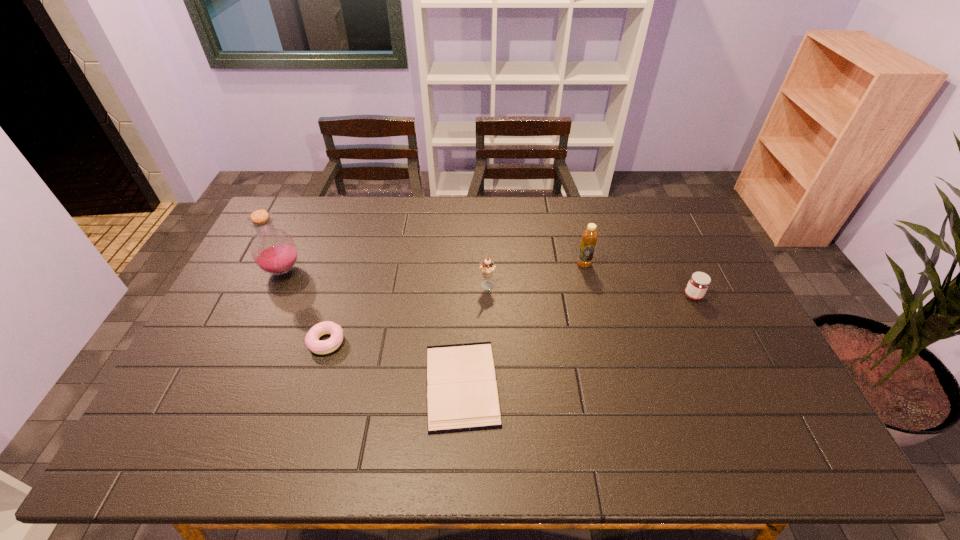
The width and height of the screenshot is (960, 540). In order to click on vacant area that lies between the shortest object and the fourth shortest object in this screenshot , I will do `click(474, 336)`.

This screenshot has width=960, height=540. In order to click on free space between the shortest object and the tallest object in this screenshot , I will do `click(372, 328)`.

Locate an element on the screen. The image size is (960, 540). free space between the icecream and the shorter bottle is located at coordinates (536, 275).

At what (x,y) coordinates should I click in order to perform the action: click on the closest object relative to the left bottle. Please return your answer as a coordinate pair (x, y). Looking at the image, I should click on (312, 341).

The image size is (960, 540). I want to click on object that stands as the third closest to the shortest object, so click(x=589, y=237).

Identify the location of vacant space that satisfies the following two spatial constraints: 1. on the back side of the third tallest object; 2. on the left side of the shortest object. The image size is (960, 540). (466, 287).

Find the location of a particular element. This screenshot has width=960, height=540. vacant space that satisfies the following two spatial constraints: 1. on the back side of the second shortest object; 2. on the right side of the icecream is located at coordinates (344, 287).

What are the coordinates of `blank area in the image that satisfies the following two spatial constraints: 1. on the back side of the shorter bottle; 2. on the right side of the shortest object` in the screenshot? It's located at (466, 264).

This screenshot has height=540, width=960. I want to click on vacant space that satisfies the following two spatial constraints: 1. on the back side of the left bottle; 2. on the left side of the second object from right to left, so click(286, 264).